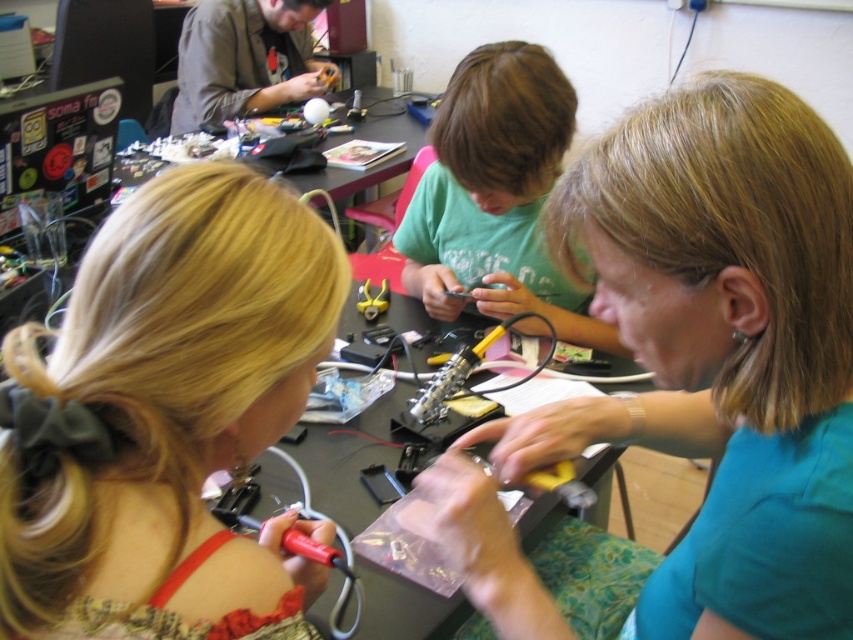
Question: Which of the following is the closest to the observer?

Choices:
 (A) blonde hair at lower left
 (B) teal matte shirt at center

Answer: (A)

Question: Is blonde hair at lower left above green matte shirt at center?

Choices:
 (A) yes
 (B) no

Answer: (B)

Question: Which of the following is the farthest from the observer?

Choices:
 (A) blonde hair at lower left
 (B) green matte shirt at center

Answer: (B)

Question: Is teal matte shirt at center positioned at the back of blonde hair at lower left?

Choices:
 (A) no
 (B) yes

Answer: (B)

Question: Which point is farther from the camera taking this photo?

Choices:
 (A) pos(749,582)
 (B) pos(299,600)
 (C) pos(486,172)

Answer: (C)

Question: Does teal matte shirt at center appear on the left side of green matte shirt at center?

Choices:
 (A) no
 (B) yes

Answer: (A)